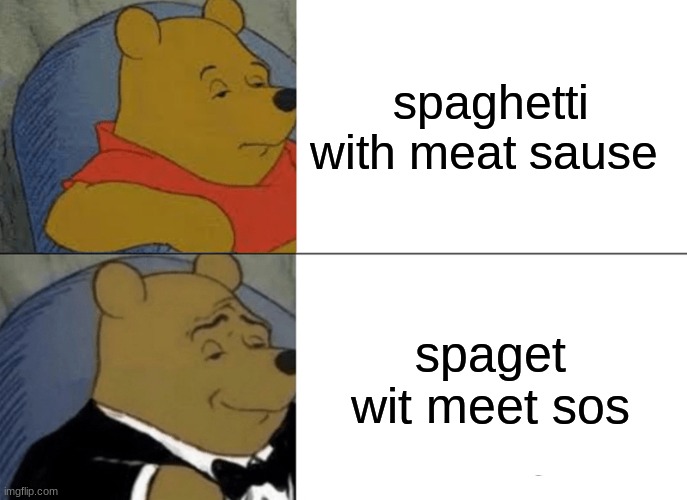
Find the location of a particular element. This screenshot has width=687, height=500. light blue chair is located at coordinates (78, 382), (91, 121).